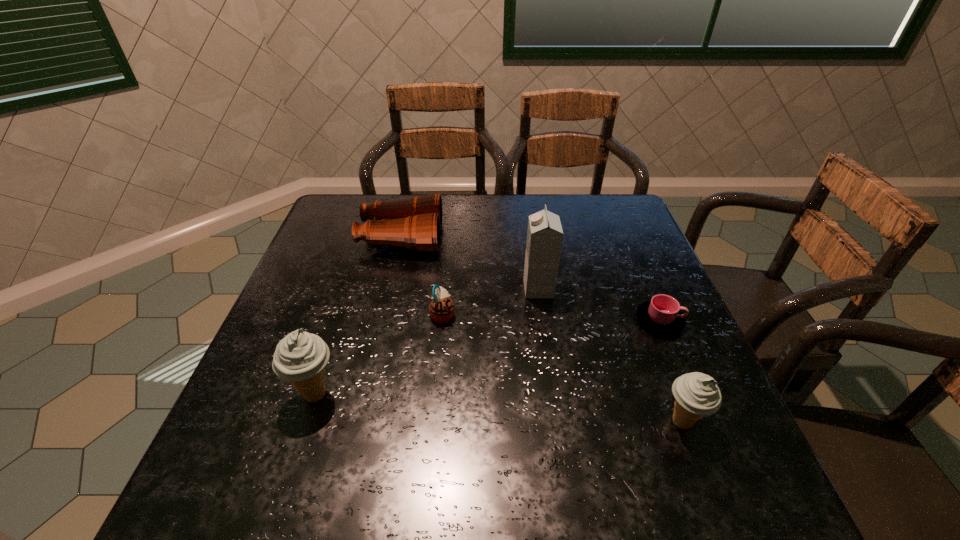
This screenshot has height=540, width=960. In the image, there is a desktop. Identify the location of vacant space at the near left corner. (239, 404).

You are a GUI agent. You are given a task and a screenshot of the screen. Output one action in this format:
    pyautogui.click(x=<x>, y=<y>)
    Task: Click on the vacant space at the far right corner of the desktop
    
    Given the screenshot: What is the action you would take?
    pyautogui.click(x=594, y=198)

At what (x,y) coordinates should I click in order to perform the action: click on free spot between the tallest object and the second tallest object. Please return your answer as a coordinate pair (x, y). This screenshot has height=540, width=960. Looking at the image, I should click on (427, 341).

You are a GUI agent. You are given a task and a screenshot of the screen. Output one action in this format:
    pyautogui.click(x=<x>, y=<y>)
    Task: Click on the free area in between the fifth shortest object and the fourth shortest object
    
    Given the screenshot: What is the action you would take?
    pyautogui.click(x=499, y=408)

Identify the location of empty location between the shortest object and the right icecream. The height and width of the screenshot is (540, 960). (x=671, y=372).

The height and width of the screenshot is (540, 960). Identify the location of vacant space that is in between the taller icecream and the right icecream. (499, 408).

Find the location of `empty space between the shortest object and the carton`. empty space between the shortest object and the carton is located at coordinates (599, 305).

The height and width of the screenshot is (540, 960). What are the coordinates of `vacant space that's between the shortest object and the left icecream` in the screenshot? It's located at (488, 357).

You are a GUI agent. You are given a task and a screenshot of the screen. Output one action in this format:
    pyautogui.click(x=<x>, y=<y>)
    Task: Click on the free space between the third tallest object and the shortest object
    Image resolution: width=960 pixels, height=540 pixels.
    Given the screenshot: What is the action you would take?
    pyautogui.click(x=671, y=372)

You are a GUI agent. You are given a task and a screenshot of the screen. Output one action in this format:
    pyautogui.click(x=<x>, y=<y>)
    Task: Click on the free space between the carton and the muffin
    
    Given the screenshot: What is the action you would take?
    pyautogui.click(x=491, y=302)